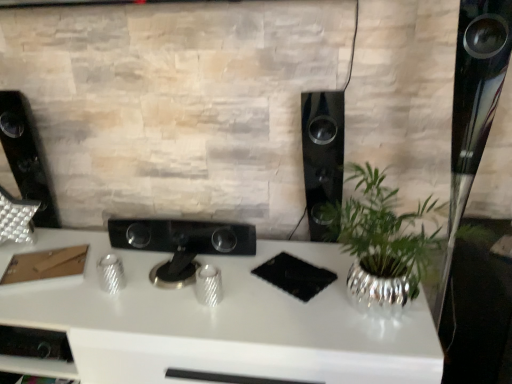
Where is `empty space that is ontop of white glossy desk at center (from a real-world perspective)`? The image size is (512, 384). empty space that is ontop of white glossy desk at center (from a real-world perspective) is located at coordinates (175, 284).